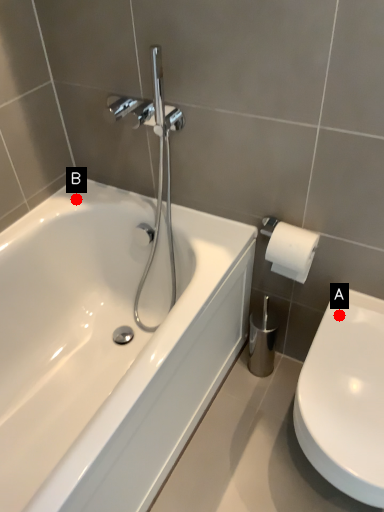
Question: Two points are circled on the image, labeled by A and B beside each circle. Which point is closer to the camera?

Choices:
 (A) A is closer
 (B) B is closer

Answer: (A)